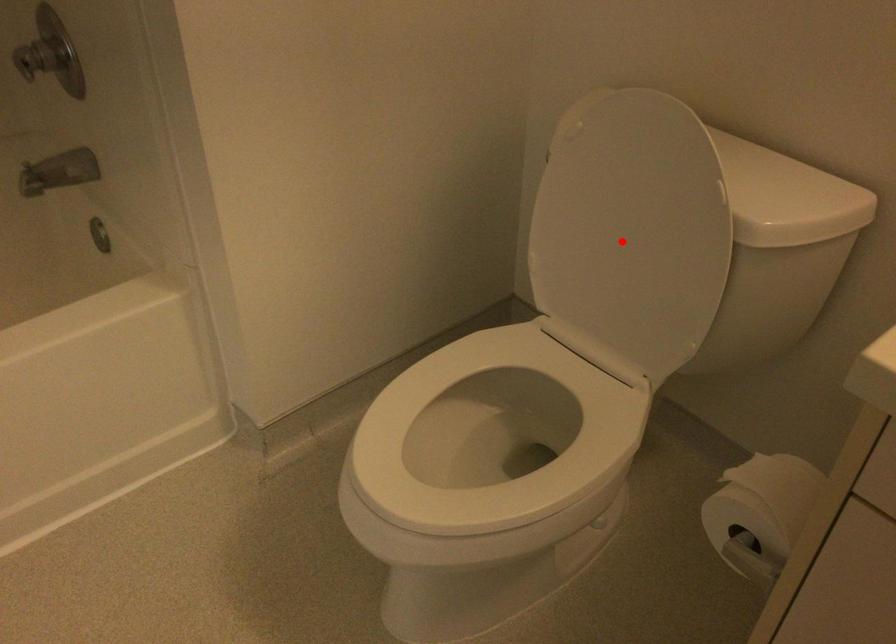
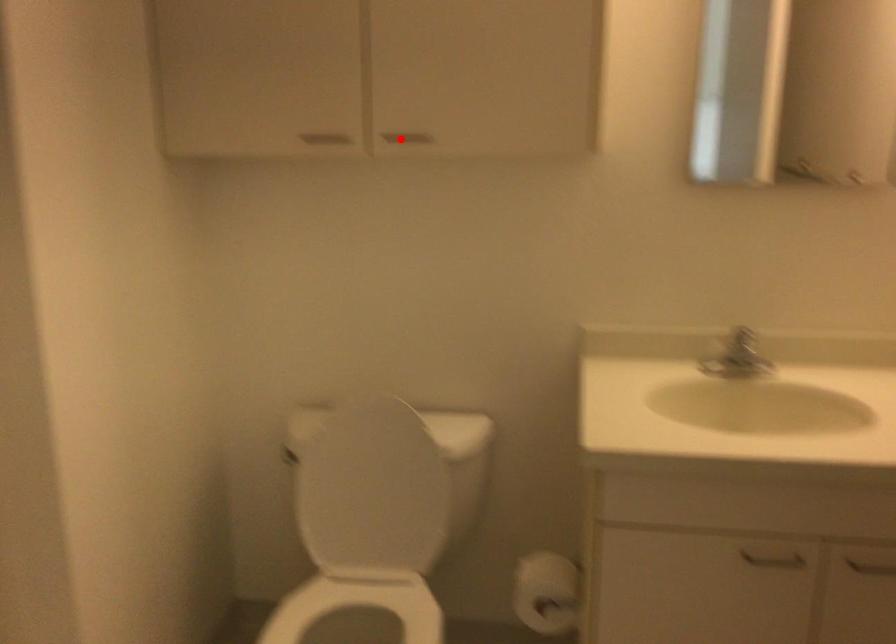
I am providing you with two images of the same scene from different viewpoints. A red point is marked on the first image and another point is marked on the second image. Is the marked point in image1 the same physical position as the marked point in image2?

No